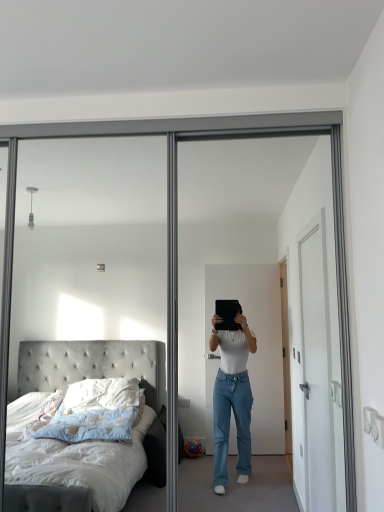
What do you see at coordinates (177, 246) in the screenshot? This screenshot has height=512, width=384. I see `transparent glass door at center` at bounding box center [177, 246].

Measure the distance between point [12,227] and camera.

6.24 feet.

Where is `transparent glass door at center`? This screenshot has width=384, height=512. transparent glass door at center is located at coordinates (177, 246).

Find the location of `transparent glass door at center`. transparent glass door at center is located at coordinates (177, 246).